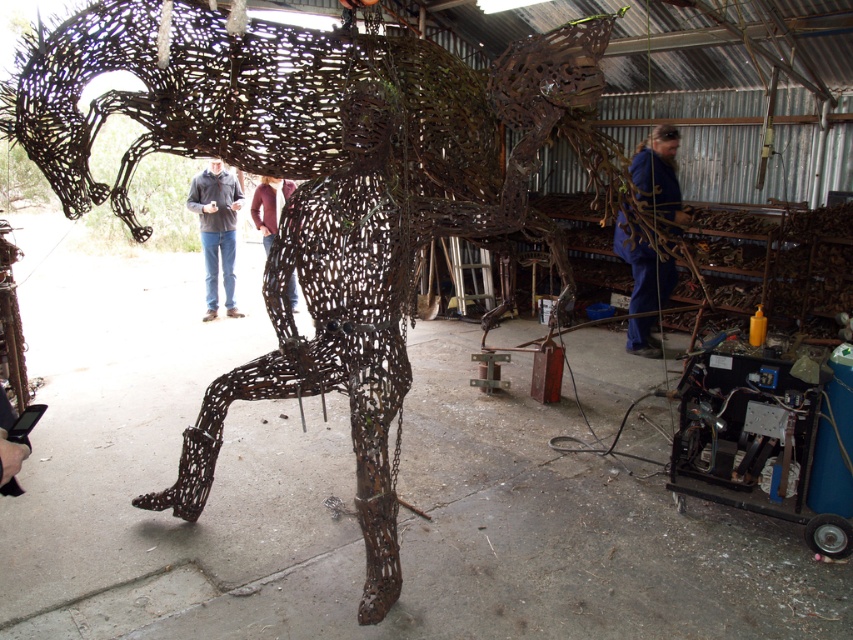
Question: Does rusty wire horse at center have a larger size compared to matte black jacket at center?

Choices:
 (A) no
 (B) yes

Answer: (B)

Question: Is blue fabric at center wider than matte black jacket at center?

Choices:
 (A) no
 (B) yes

Answer: (B)

Question: Does blue fabric at center appear over matte black jacket at center?

Choices:
 (A) yes
 (B) no

Answer: (B)

Question: Which object is positioned farthest from the rustic wire horse at center?

Choices:
 (A) rusty wire horse at center
 (B) blue fabric at center

Answer: (A)

Question: Among these points, which one is nearest to the camera?

Choices:
 (A) [x=270, y=230]
 (B) [x=668, y=264]

Answer: (B)

Question: Which is farther from the rustic wire horse at center?

Choices:
 (A) matte black jacket at center
 (B) rusty wire horse at center

Answer: (B)